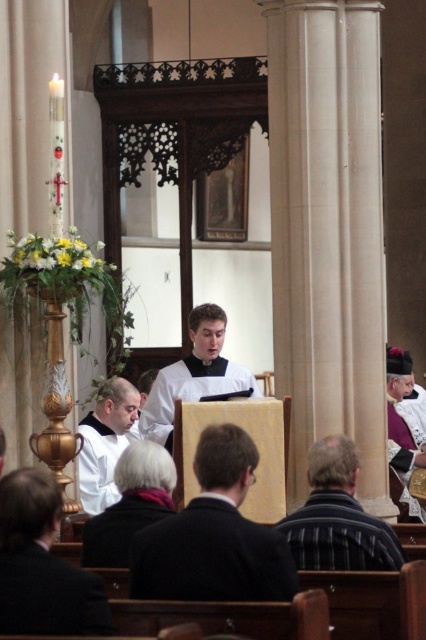
Question: Among these objects, which one is farthest from the camera?

Choices:
 (A) dark woolen robe at lower center
 (B) white matte vest at center
 (C) dark suit at center
 (D) purple velvet robe at center

Answer: (D)

Question: Estimate the real-world distances between objects in this image. Which object is closer to the purple velvet robe at center?

Choices:
 (A) dark suit at center
 (B) striped fabric shirt at lower center

Answer: (B)

Question: Can you confirm if striped fabric shirt at lower center is smaller than dark woolen robe at lower center?

Choices:
 (A) yes
 (B) no

Answer: (B)

Question: Does dark suit at center have a smaller size compared to dark gray woolen robe at lower center?

Choices:
 (A) no
 (B) yes

Answer: (A)

Question: Which object is the farthest from the white matte vest at center?

Choices:
 (A) dark woolen robe at lower center
 (B) dark gray woolen robe at lower center
 (C) striped fabric shirt at lower center
 (D) dark suit at center

Answer: (A)

Question: Is the position of dark suit at center more distant than that of dark woolen robe at lower center?

Choices:
 (A) no
 (B) yes

Answer: (B)